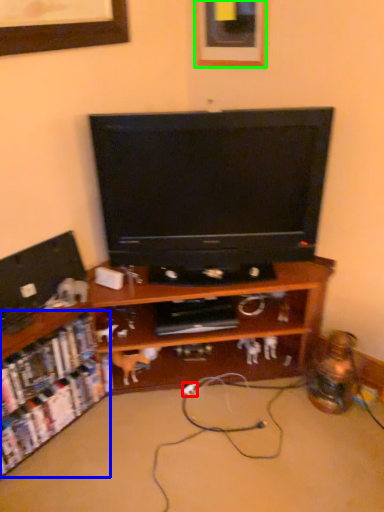
Question: Considering the real-world distances, which object is closest to extension cord (highlighted by a red box)? shelf (highlighted by a blue box) or picture frame (highlighted by a green box).

Choices:
 (A) shelf
 (B) picture frame

Answer: (A)